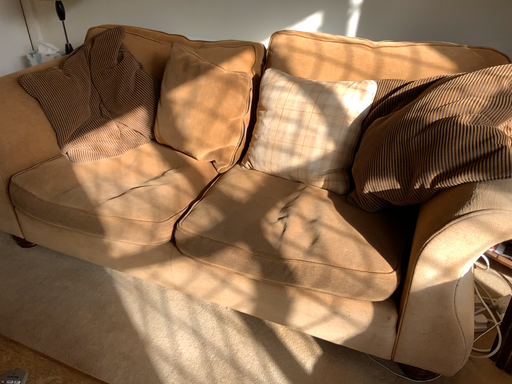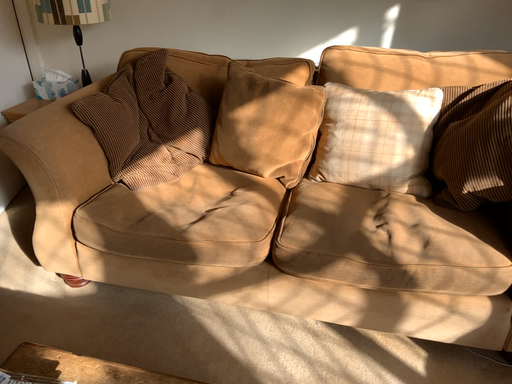
Question: Which way did the camera rotate in the video?

Choices:
 (A) rotated right
 (B) rotated left

Answer: (A)